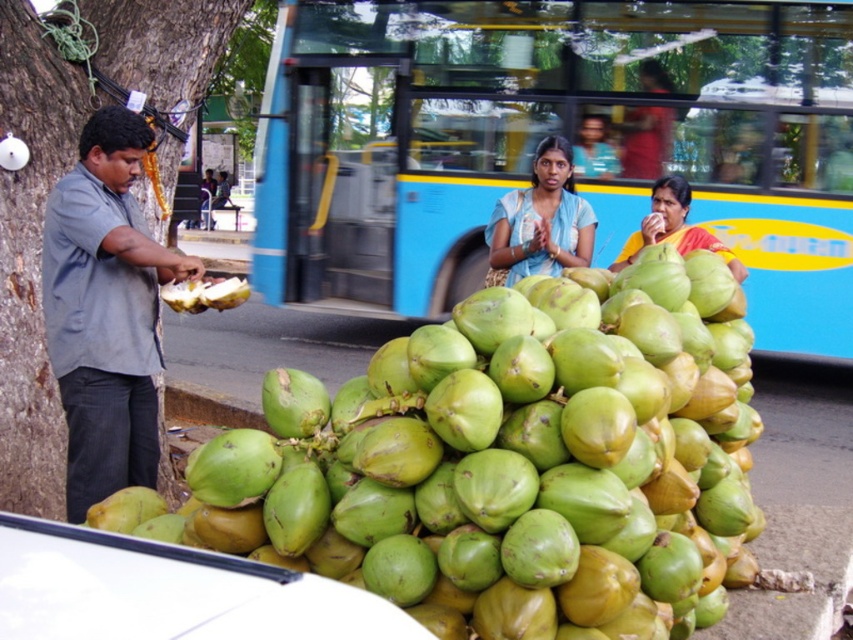
You are a customer at the coconut vendor stand. You want to pick up the green matte coconut at center and the white matte coconut at center. Which one do you need to reach further to grab?

The white matte coconut at center requires reaching further because it is farther from the viewer compared to the green matte coconut at center.

You are standing in the street scene and want to move from the coconut vendor to a specific point. Which of the two points, point (505, 541) or point (210, 282), is closer to you?

Point (505, 541) is closer to the viewer than point (210, 282).